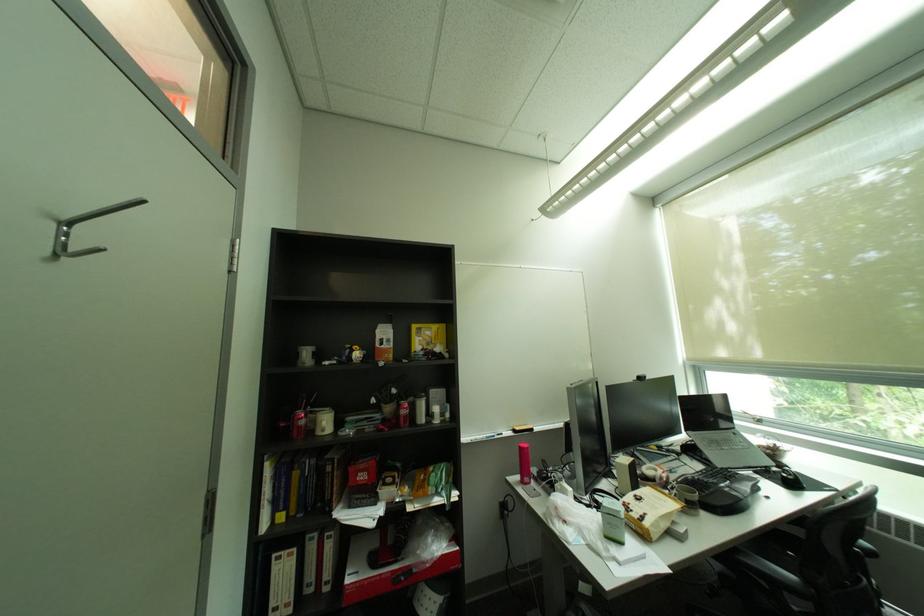
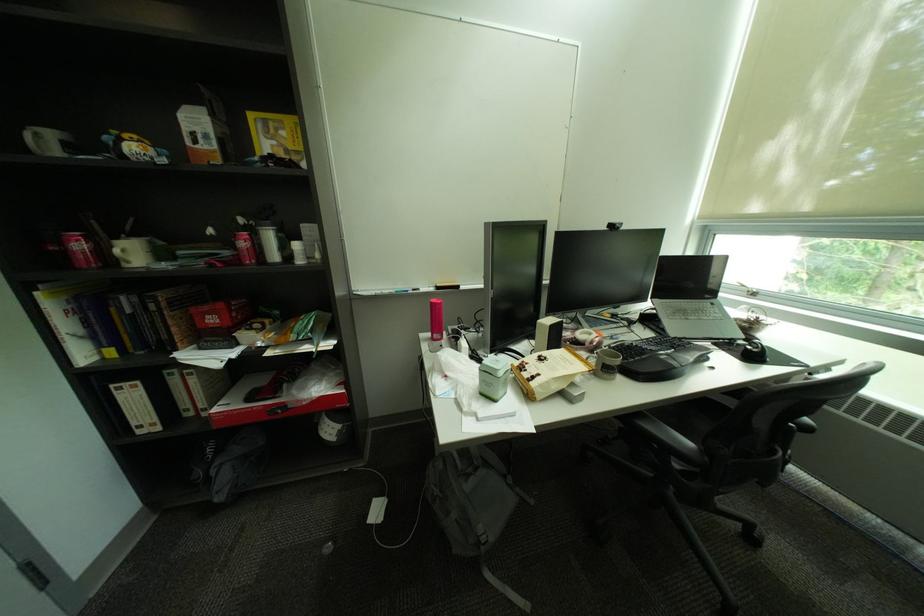
Question: Based on the continuous images, in which direction is the camera rotating? Reply with the corresponding letter.

Choices:
 (A) Left
 (B) Right
 (C) Up
 (D) Down

Answer: (D)